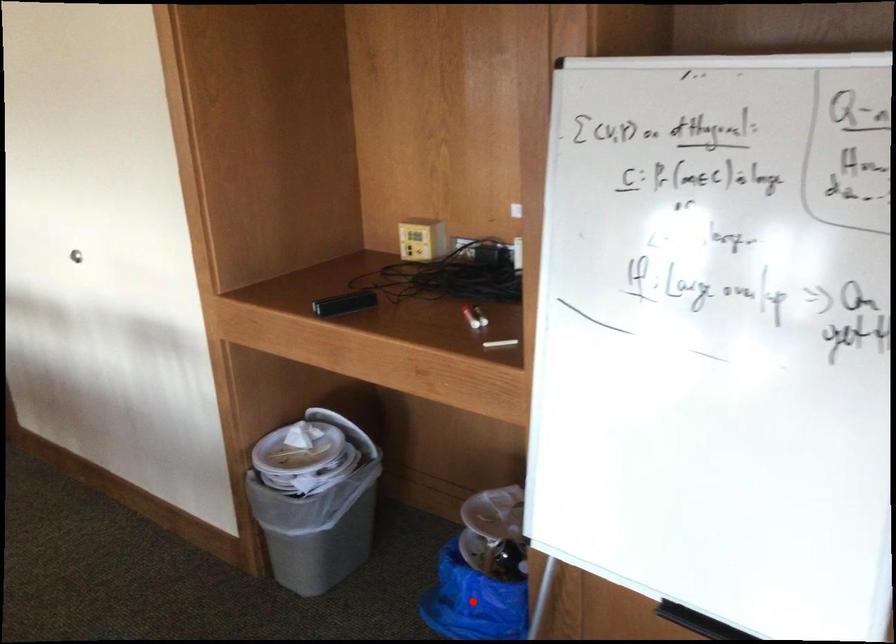
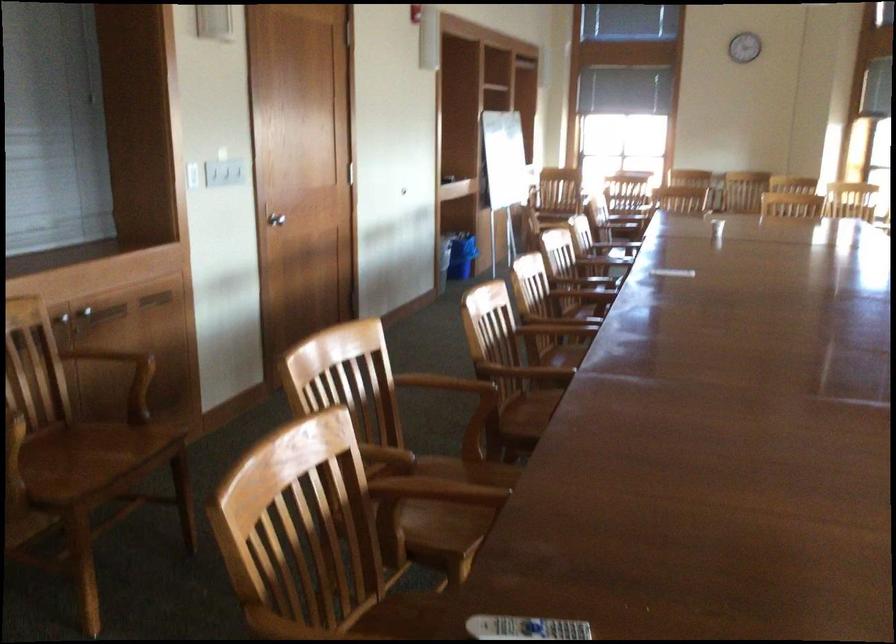
Question: I am providing you with two images of the same scene from different viewpoints. A red point is marked on the first image. Is the red point's position out of view in image 2?

Choices:
 (A) Yes
 (B) No

Answer: (A)